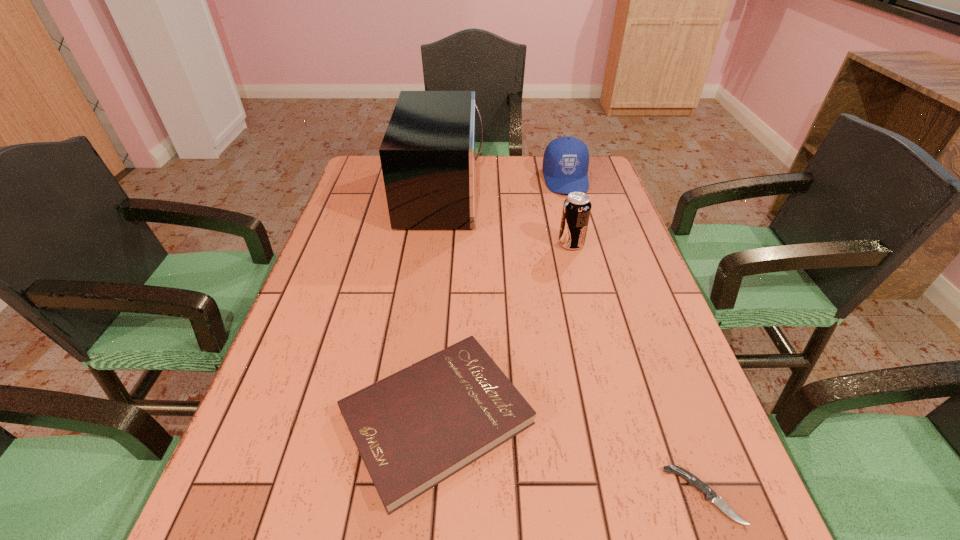
This screenshot has height=540, width=960. I want to click on vacant space that is in between the tallest object and the third shortest object, so click(504, 186).

Point out which object is positioned as the nearest to the hardback book. Please provide its 2D coordinates. Your answer should be formatted as a tuple, i.e. [(x, y)], where the tuple contains the x and y coordinates of a point satisfying the conditions above.

[(710, 495)]

Identify the location of object that is the second closest to the microwave oven. (576, 211).

Image resolution: width=960 pixels, height=540 pixels. What are the coordinates of `free space in the image that satisfies the following two spatial constraints: 1. with the door open on the tallest object; 2. on the left side of the pocketknife` in the screenshot? It's located at (406, 495).

You are a GUI agent. You are given a task and a screenshot of the screen. Output one action in this format:
    pyautogui.click(x=<x>, y=<y>)
    Task: Click on the free location that satisfies the following two spatial constraints: 1. with the door open on the microwave oven; 2. on the back side of the soda can
    The image size is (960, 540).
    Given the screenshot: What is the action you would take?
    pyautogui.click(x=436, y=244)

Find the location of `free space that satisfies the following two spatial constraints: 1. on the front-facing side of the cap; 2. with the door open on the tallest object`. free space that satisfies the following two spatial constraints: 1. on the front-facing side of the cap; 2. with the door open on the tallest object is located at coordinates (569, 194).

I want to click on free location that satisfies the following two spatial constraints: 1. on the front-facing side of the pocketknife; 2. on the right side of the cap, so click(656, 495).

At what (x,y) coordinates should I click in order to perform the action: click on blank area in the image that satisfies the following two spatial constraints: 1. on the front-facing side of the shortest object; 2. on the right side of the cap. Please return your answer as a coordinate pair (x, y). Looking at the image, I should click on (656, 495).

This screenshot has height=540, width=960. In order to click on vacant position in the image that satisfies the following two spatial constraints: 1. with the door open on the fourth tallest object; 2. on the right side of the tallest object in this screenshot , I will do `click(415, 417)`.

Locate an element on the screen. free spot that satisfies the following two spatial constraints: 1. on the front-facing side of the pocketknife; 2. on the right side of the cap is located at coordinates (656, 495).